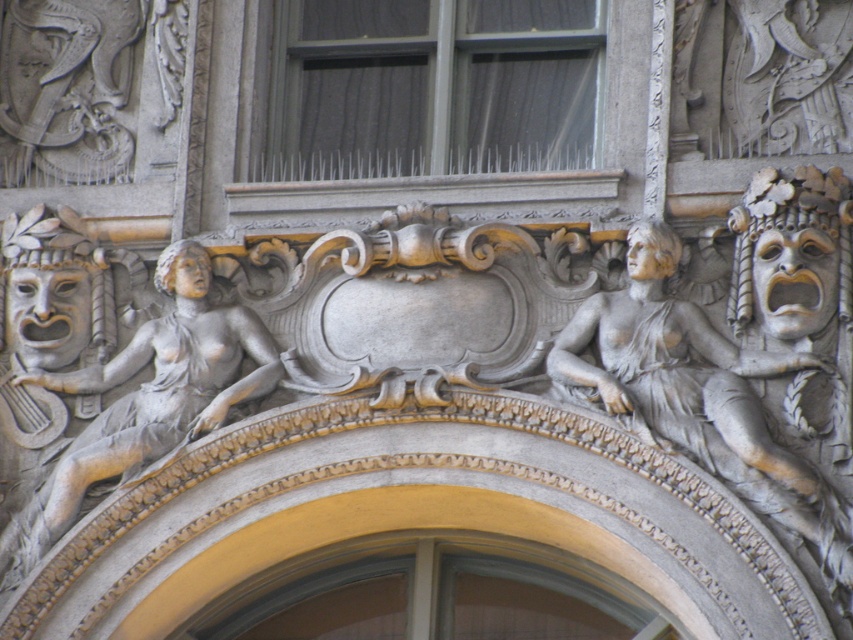
Question: In this image, where is gray stone female figure at right located relative to gray stone woman at center?

Choices:
 (A) right
 (B) left

Answer: (A)

Question: Can you confirm if gray stone female figure at right is smaller than gray stone woman at center?

Choices:
 (A) yes
 (B) no

Answer: (A)

Question: Among these objects, which one is nearest to the camera?

Choices:
 (A) gray stone female figure at right
 (B) gray stone woman at center

Answer: (A)

Question: Does gray stone female figure at right appear over gray stone woman at center?

Choices:
 (A) no
 (B) yes

Answer: (B)